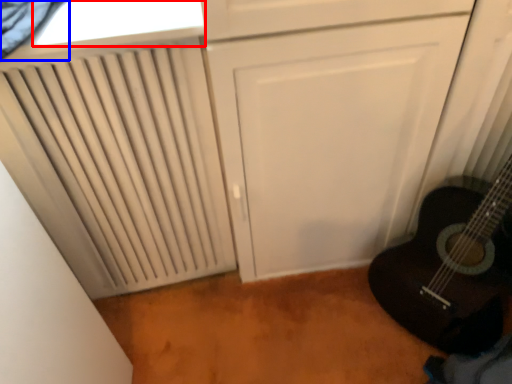
Question: Which object is further to the camera taking this photo, window (highlighted by a red box) or curtain (highlighted by a blue box)?

Choices:
 (A) window
 (B) curtain

Answer: (A)